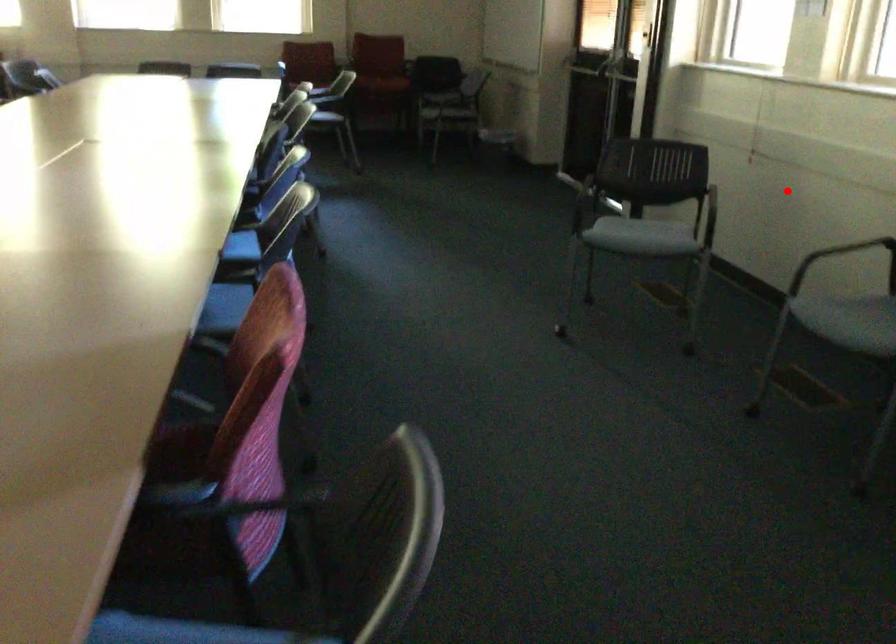
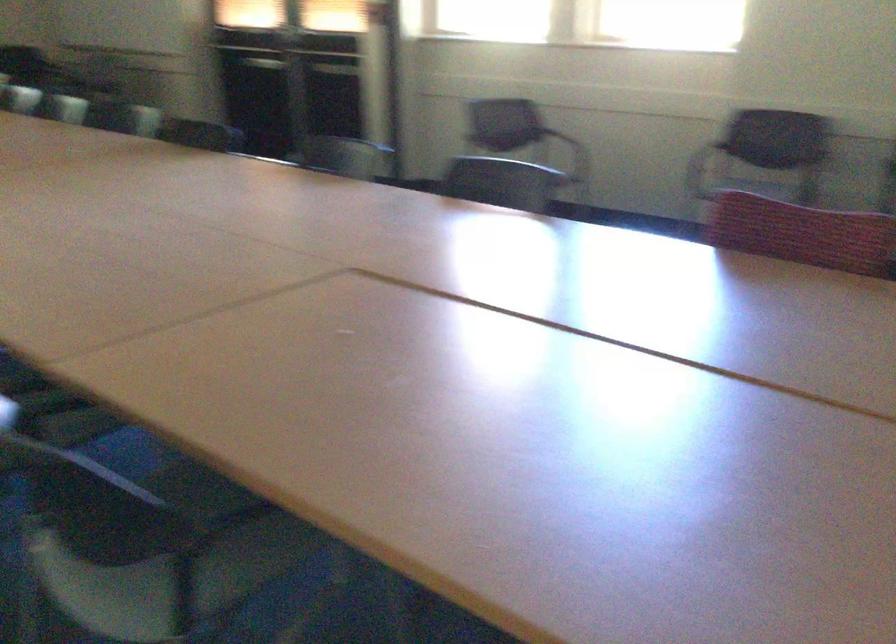
Find the pixel in the second image that matches the highlighted location in the first image.

(560, 136)